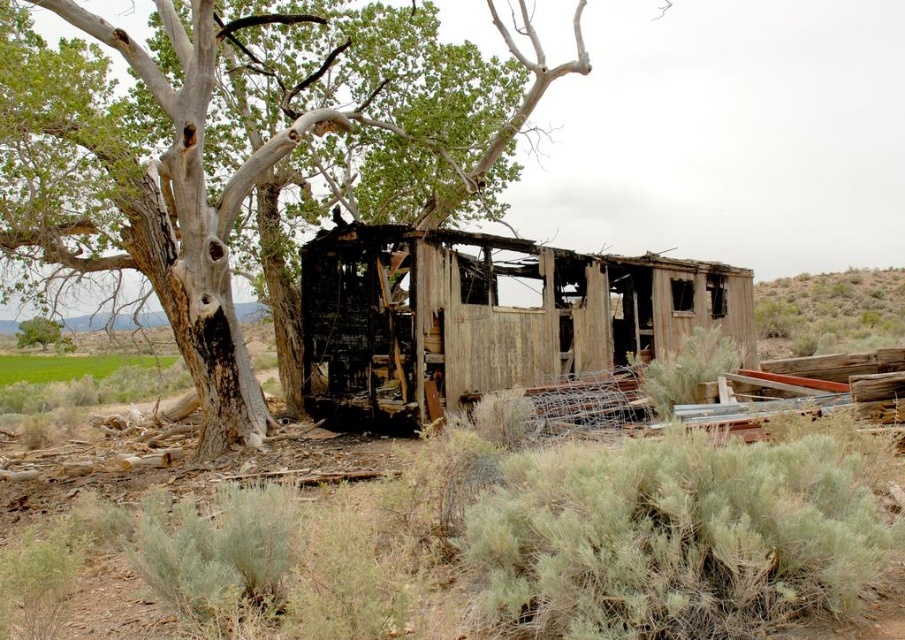
Question: Does gray bark tree at center have a smaller size compared to weathered wood hut at center?

Choices:
 (A) no
 (B) yes

Answer: (A)

Question: In this image, where is weathered wood hut at center located relative to green shrubbery at right?

Choices:
 (A) above
 (B) below

Answer: (B)

Question: Which object appears closest to the camera in this image?

Choices:
 (A) green shrubbery at right
 (B) weathered wood hut at center
 (C) gray bark tree at center

Answer: (C)

Question: Does weathered wood hut at center appear over green shrubbery at right?

Choices:
 (A) yes
 (B) no

Answer: (B)

Question: Based on their relative distances, which object is nearer to the green shrubbery at right?

Choices:
 (A) weathered wood hut at center
 (B) gray bark tree at center

Answer: (A)

Question: Which object appears closest to the camera in this image?

Choices:
 (A) gray bark tree at center
 (B) weathered wood hut at center
 (C) green shrubbery at right

Answer: (A)